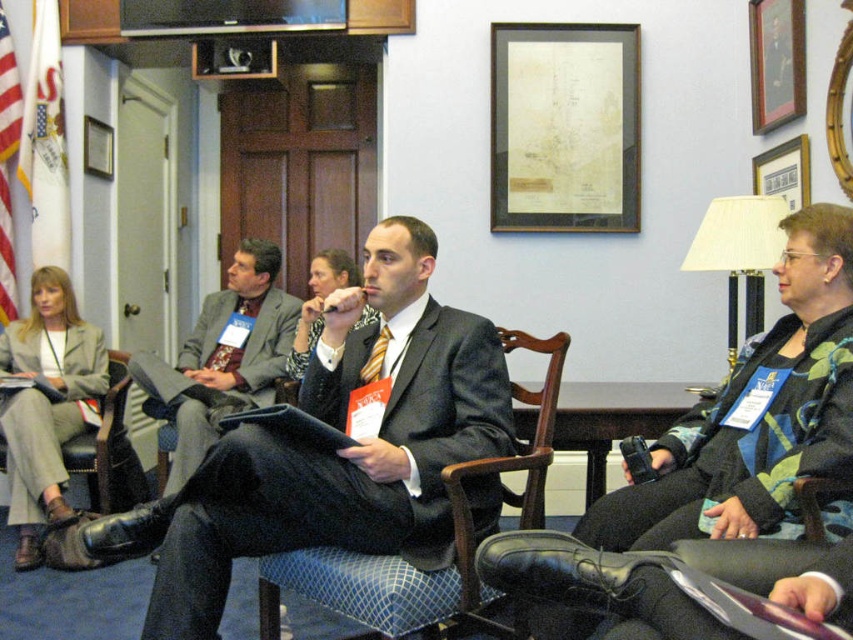
Does matte black suit at center have a larger size compared to black woolen jacket at lower right?

Yes.

Does matte black suit at center appear under black woolen jacket at lower right?

Correct, matte black suit at center is located below black woolen jacket at lower right.

Locate an element on the screen. matte black suit at center is located at coordinates (337, 476).

Locate an element on the screen. matte black suit at center is located at coordinates [x=337, y=476].

Can you confirm if wooden framed portrait at upper right is positioned to the right of leather armchair at lower left?

Indeed, wooden framed portrait at upper right is positioned on the right side of leather armchair at lower left.

Which of these two, wooden framed portrait at upper right or leather armchair at lower left, stands shorter?

With less height is wooden framed portrait at upper right.

Is point (801, 102) closer to camera compared to point (115, 410)?

Yes, it is in front of point (115, 410).

Find the location of a particular element. This screenshot has height=640, width=853. wooden framed portrait at upper right is located at coordinates (776, 61).

Which of these two, black woolen jacket at lower right or yellow striped tie at center, stands taller?

→ With more height is black woolen jacket at lower right.

Identify the location of black woolen jacket at lower right. This screenshot has width=853, height=640. (743, 444).